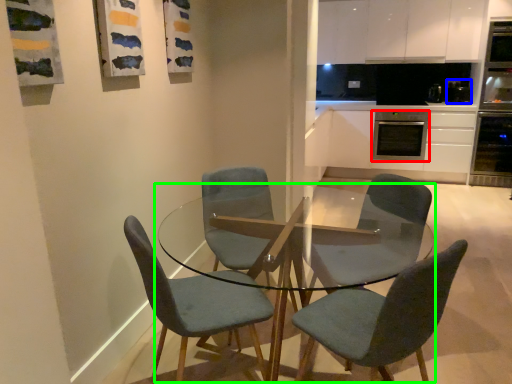
Question: Which object is the closest to the kitchen appliance (highlighted by a red box)? Choose among these: appliance (highlighted by a blue box) or coffee table (highlighted by a green box).

Choices:
 (A) appliance
 (B) coffee table

Answer: (A)